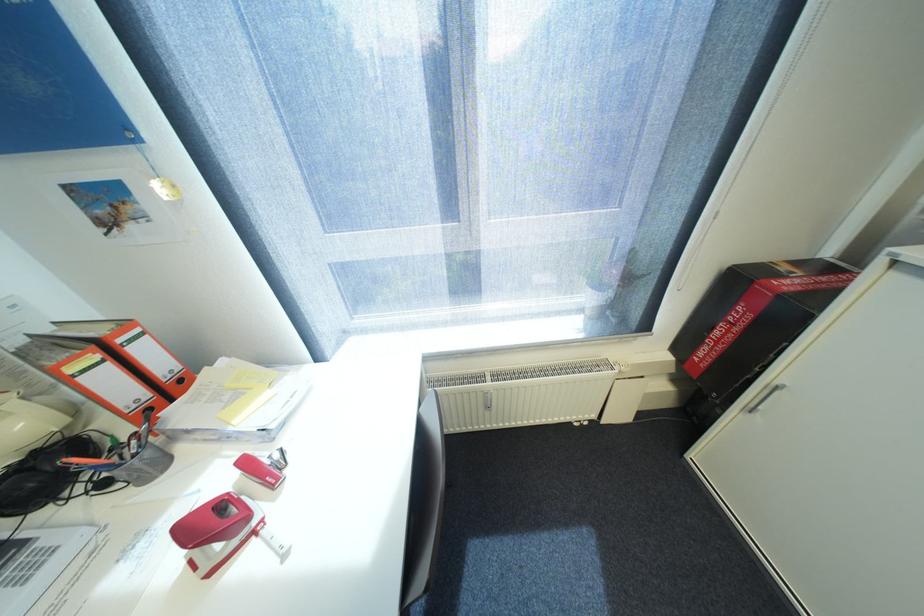
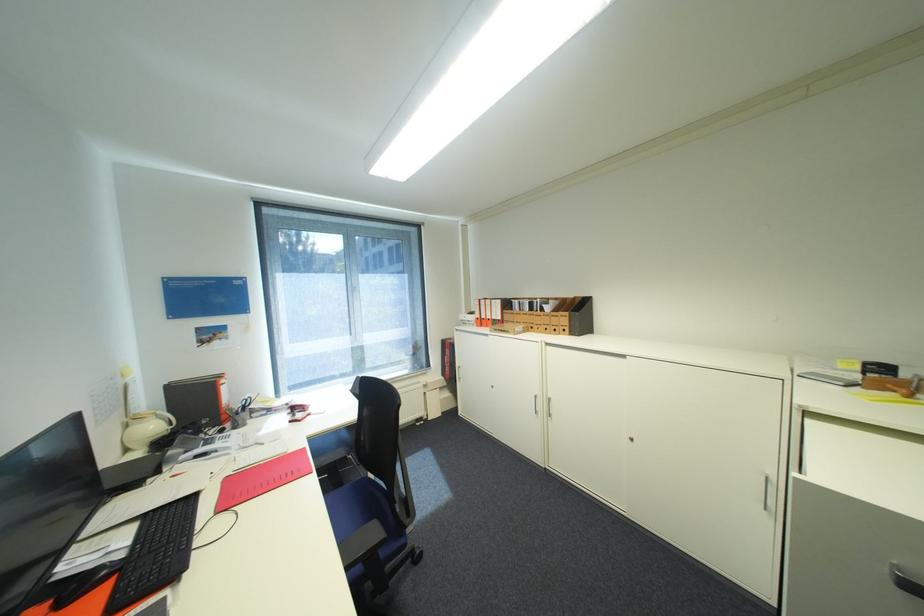
Find the pixel in the second image that matches point 30,424 in the first image.

(161, 427)